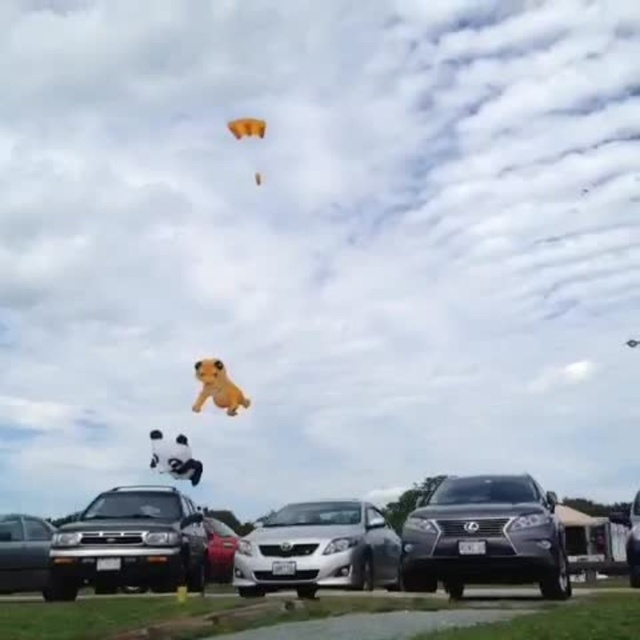
Who is taller, matte black suv at center or yellow plush dog at center?

yellow plush dog at center is taller.

Which is in front, point (552, 516) or point (227, 380)?

Positioned in front is point (552, 516).

Locate an element on the screen. The height and width of the screenshot is (640, 640). matte black suv at center is located at coordinates (484, 536).

Can you confirm if matte black suv at lower left is positioned below matte black sedan at lower left?

Actually, matte black suv at lower left is above matte black sedan at lower left.

Is matte black suv at lower left shorter than matte black sedan at lower left?

In fact, matte black suv at lower left may be taller than matte black sedan at lower left.

Who is more forward, (192, 564) or (19, 566)?

Point (192, 564) is in front.

Image resolution: width=640 pixels, height=640 pixels. I want to click on matte black suv at lower left, so click(129, 545).

Does matte black suv at center have a lesser height compared to matte black sedan at lower left?

Indeed, matte black suv at center has a lesser height compared to matte black sedan at lower left.

Does point (451, 476) lie behind point (42, 536)?

Yes, point (451, 476) is farther from viewer.

Which is in front, point (509, 483) or point (42, 552)?

Point (509, 483) is more forward.

This screenshot has width=640, height=640. I want to click on matte black suv at center, so click(x=484, y=536).